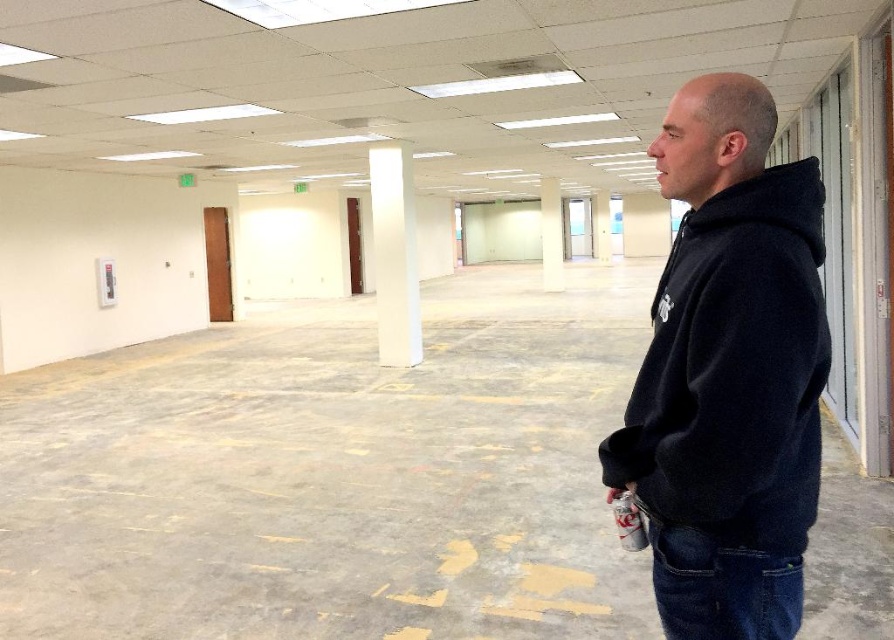
You are an office worker who needs to pass through the area between the black fleece jacket at right and the white glossy column at center. Can you walk through this space comfortably?

The black fleece jacket at right has a lesser width compared to white glossy column at center, so the space between them is likely sufficient for comfortable passage.

You are a delivery person standing at the entrance of the office. You need to place a package near the black fleece jacket at right and the white glossy column at center. The delivery robot you use has a maximum delivery range of 6 meters. Can the robot deliver the package to both locations without needing a recharge?

The black fleece jacket at right is 6.76 meters away from the white glossy column at center. Since the robot can only travel 6 meters, it cannot reach both locations without recharging. The distance between them exceeds the robot s maximum range.